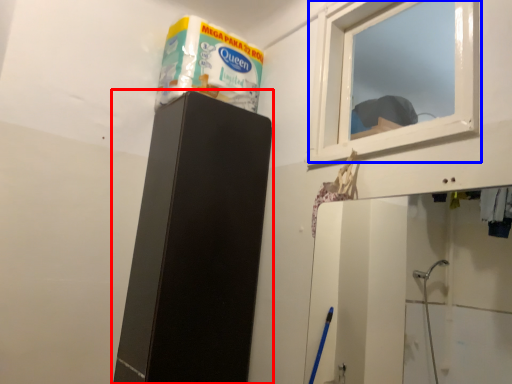
Question: Which of the following is the farthest to the observer, furniture (highlighted by a red box) or window (highlighted by a blue box)?

Choices:
 (A) furniture
 (B) window

Answer: (A)